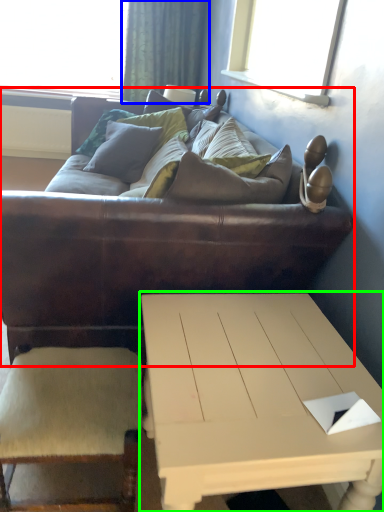
Question: Which is nearer to the studio couch (highlighted by a red box)? curtain (highlighted by a blue box) or coffee table (highlighted by a green box).

Choices:
 (A) curtain
 (B) coffee table

Answer: (B)